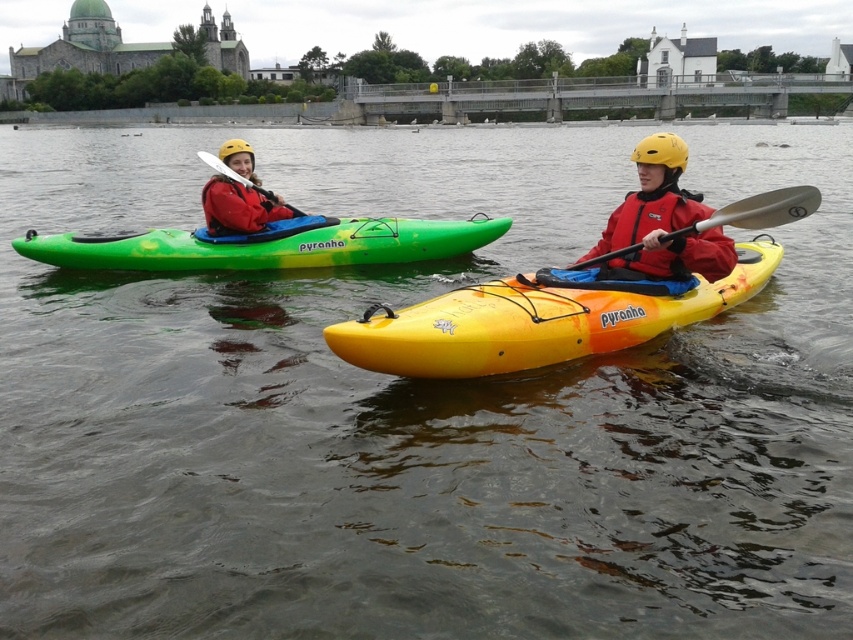
Question: Does matte red jacket at center have a larger size compared to matte red jacket at left?

Choices:
 (A) no
 (B) yes

Answer: (A)

Question: Is matte red jacket at center below matte red jacket at left?

Choices:
 (A) no
 (B) yes

Answer: (B)

Question: Based on their relative distances, which object is nearer to the yellow matte kayak at center?

Choices:
 (A) matte red jacket at center
 (B) matte red jacket at left
 (C) green matte kayak at left
 (D) silver metallic paddle at center

Answer: (A)

Question: Which is nearer to the silver metallic paddle at center?

Choices:
 (A) matte red jacket at left
 (B) matte red jacket at center
 (C) green matte kayak at left
 (D) yellow matte kayak at center

Answer: (B)

Question: Which point is closer to the camera?

Choices:
 (A) matte red jacket at left
 (B) green matte kayak at left
 (C) matte red jacket at center

Answer: (C)

Question: Does matte red jacket at left have a greater width compared to silver metallic paddle at center?

Choices:
 (A) no
 (B) yes

Answer: (B)